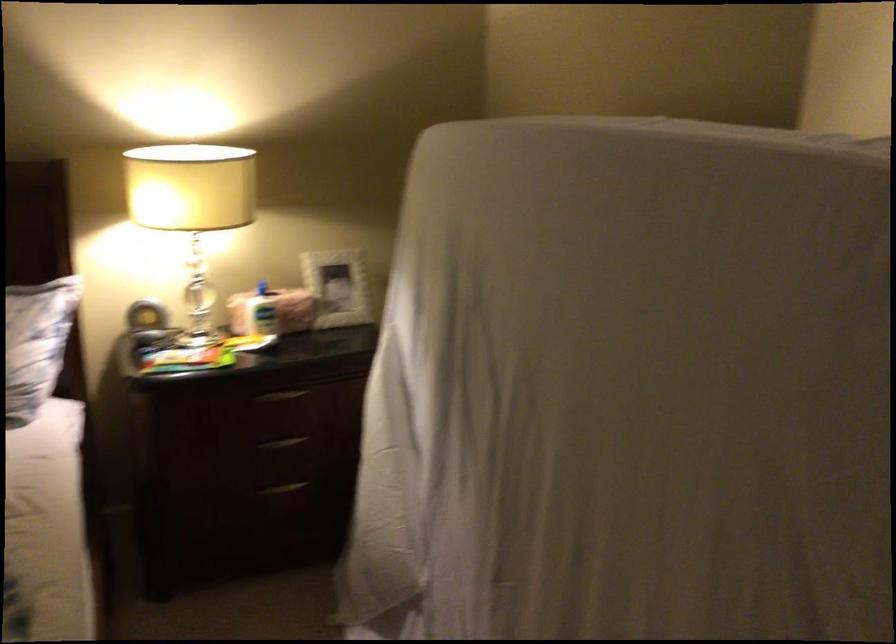
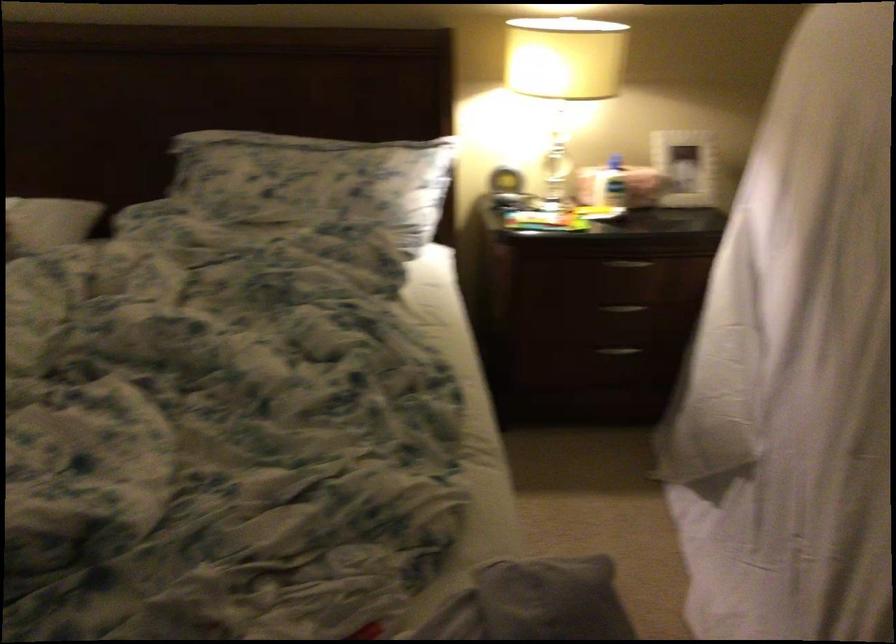
In the second image, find the point that corresponds to the point at 259,317 in the first image.

(609, 184)